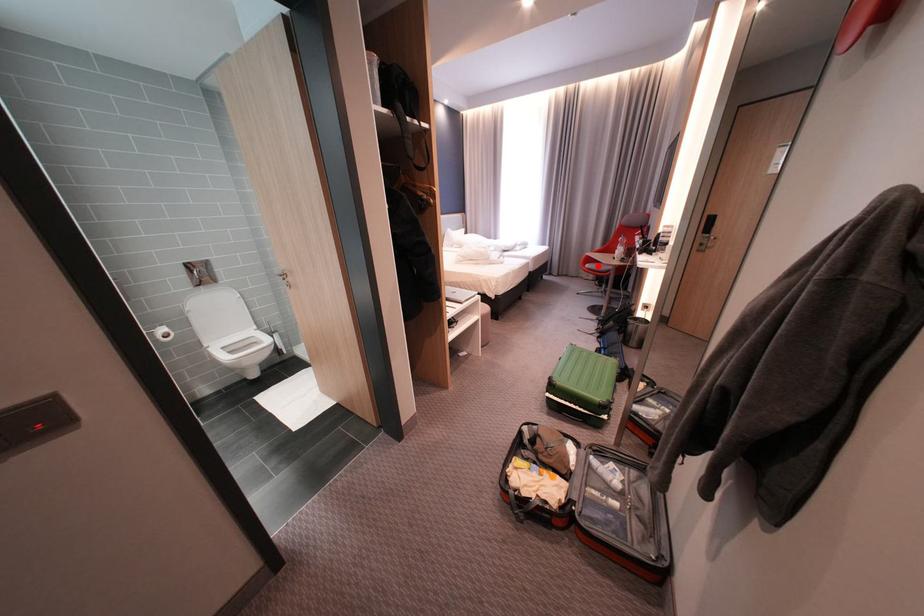
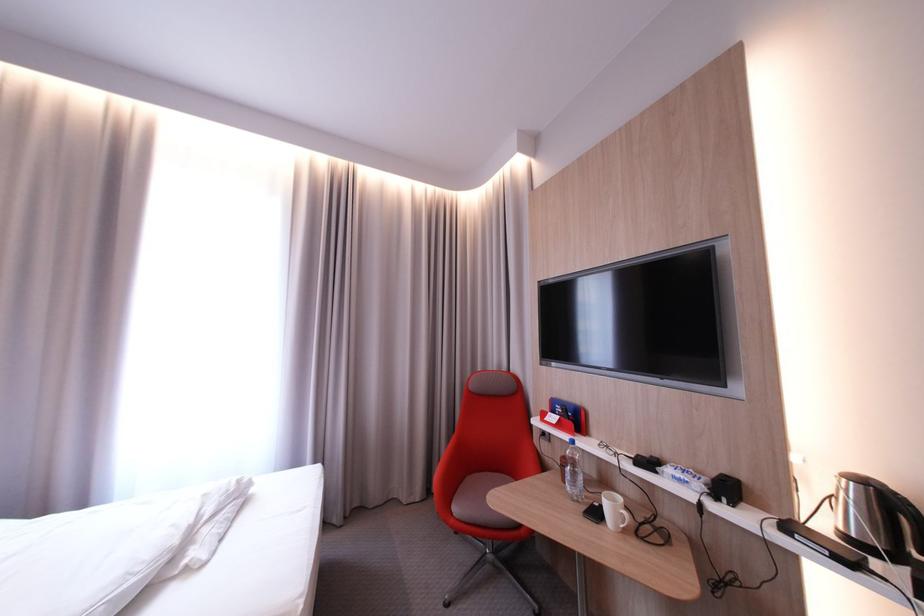
Question: I am providing you with two images of the same scene from different viewpoints. Given a red point in image1, look at the same physical point in image2. Is it:

Choices:
 (A) Closer to the viewpoint
 (B) Farther from the viewpoint

Answer: (B)